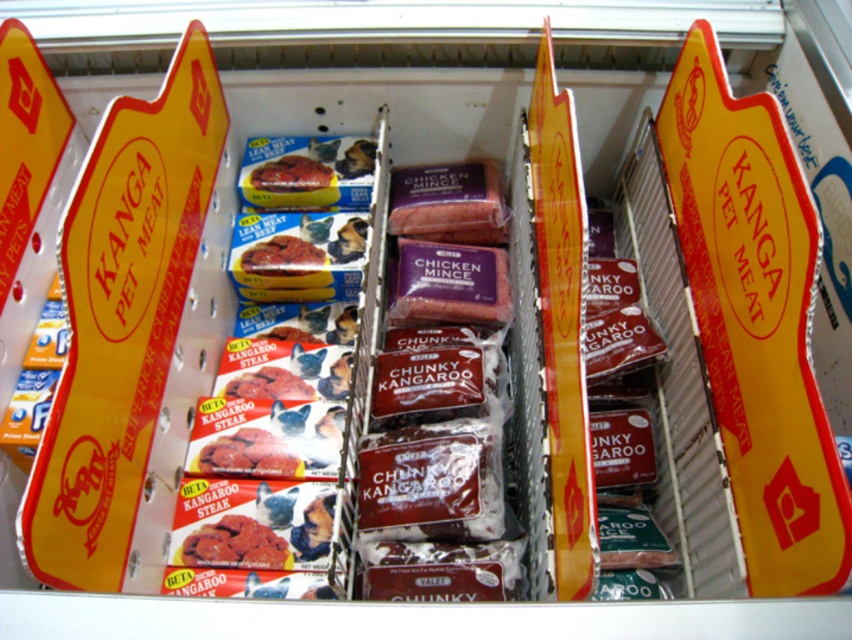
Question: Does dark red raw meat at center appear under matte red pet food at center?

Choices:
 (A) no
 (B) yes

Answer: (B)

Question: Can you confirm if dark red raw meat at center is thinner than matte red pet food at center?

Choices:
 (A) no
 (B) yes

Answer: (B)

Question: Is dark red raw meat at center positioned in front of matte red pet food at center?

Choices:
 (A) yes
 (B) no

Answer: (A)

Question: Which point appears closest to the camera in this image?

Choices:
 (A) (314, 182)
 (B) (286, 552)

Answer: (B)